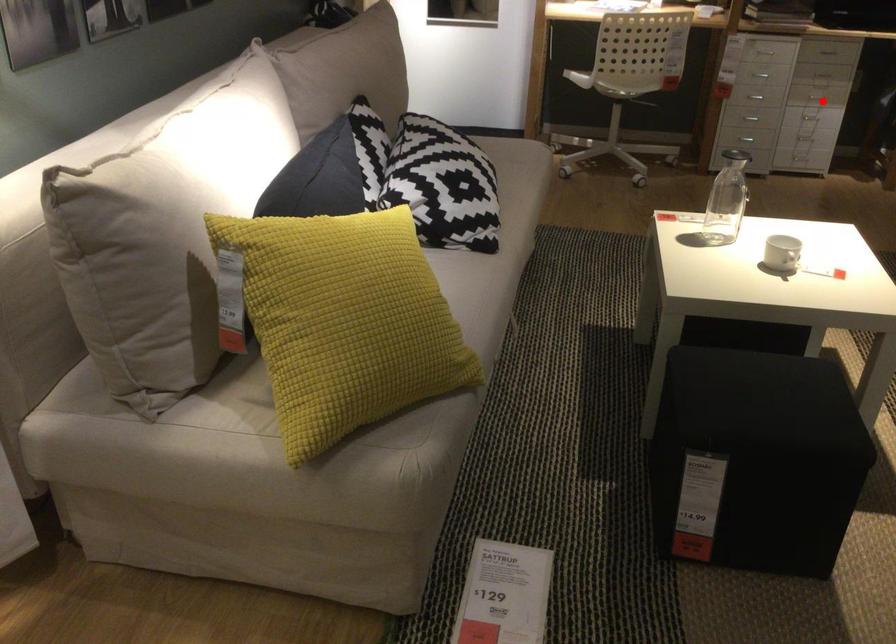
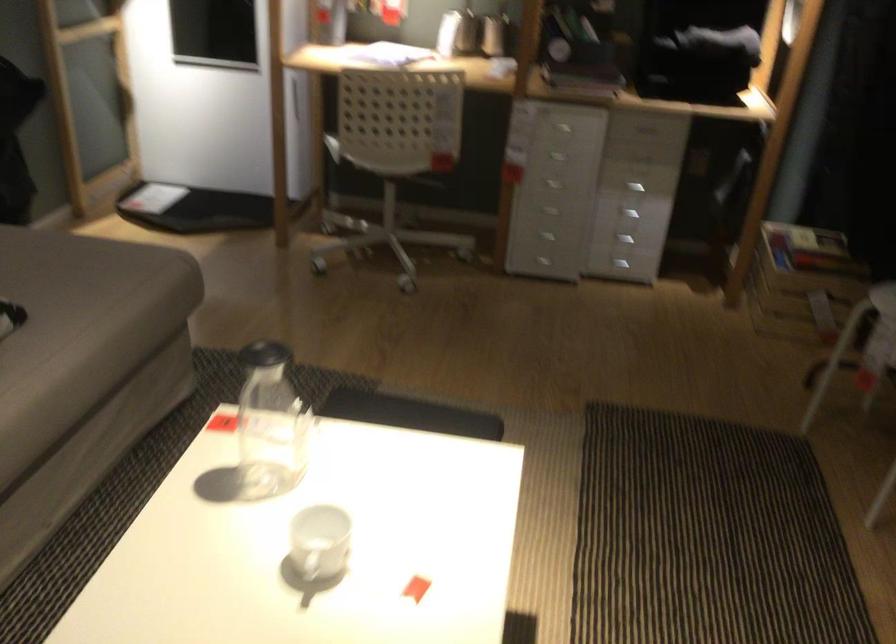
Question: I am providing you with two images of the same scene from different viewpoints. A red point is shown in image1. For the corresponding object point in image2, is it positioned nearer or farther from the camera?

Choices:
 (A) Nearer
 (B) Farther

Answer: (A)